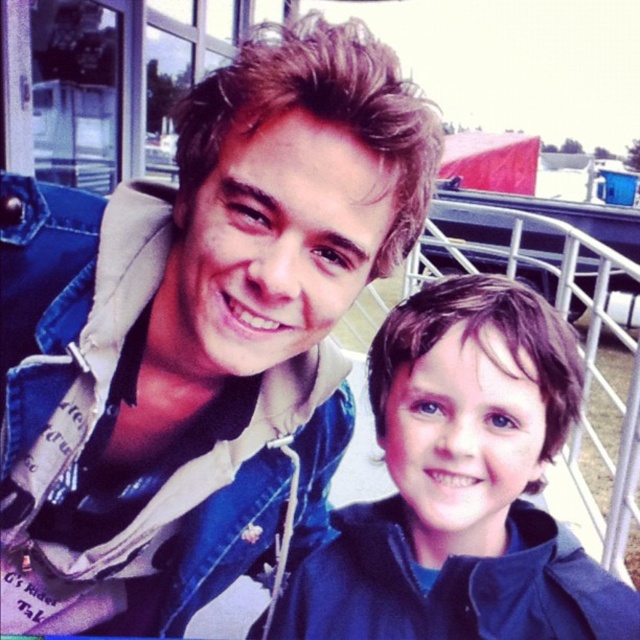
Question: Estimate the real-world distances between objects in this image. Which object is closer to the denim jacket at upper left?

Choices:
 (A) metallic silver rail at lower right
 (B) matte blue jacket at lower right

Answer: (B)

Question: Does denim jacket at upper left appear on the left side of matte blue jacket at lower right?

Choices:
 (A) yes
 (B) no

Answer: (A)

Question: Is matte blue jacket at lower right thinner than metallic silver rail at lower right?

Choices:
 (A) yes
 (B) no

Answer: (A)

Question: Can you confirm if denim jacket at upper left is wider than metallic silver rail at lower right?

Choices:
 (A) no
 (B) yes

Answer: (B)

Question: Which object is closer to the camera taking this photo?

Choices:
 (A) matte blue jacket at lower right
 (B) metallic silver rail at lower right

Answer: (A)

Question: Which object is farther from the camera taking this photo?

Choices:
 (A) denim jacket at upper left
 (B) matte blue jacket at lower right
 (C) metallic silver rail at lower right

Answer: (C)